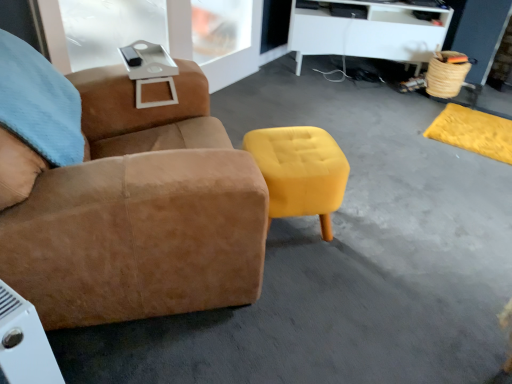
Question: Is white matte desk at upper center spatially inside yellow suede ottoman at center, or outside of it?

Choices:
 (A) outside
 (B) inside

Answer: (A)

Question: From a real-world perspective, relative to yellow suede ottoman at center, is white matte desk at upper center vertically above or below?

Choices:
 (A) below
 (B) above

Answer: (B)

Question: Based on their relative distances, which object is nearer to the yellow suede ottoman at center?

Choices:
 (A) suede brown chair at center
 (B) white matte desk at upper center

Answer: (A)

Question: Estimate the real-world distances between objects in this image. Which object is farther from the yellow suede ottoman at center?

Choices:
 (A) suede brown chair at center
 (B) white matte desk at upper center

Answer: (B)